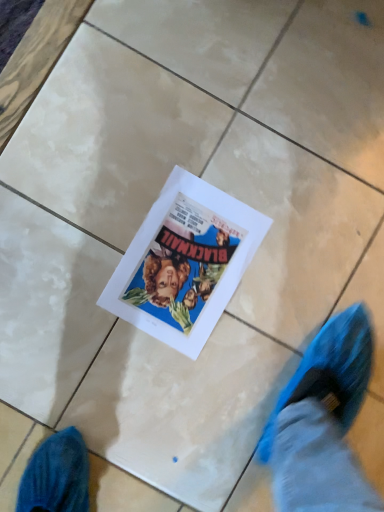
What do you see at coordinates (184, 262) in the screenshot? Image resolution: width=384 pixels, height=512 pixels. I see `white paper at center` at bounding box center [184, 262].

At what (x,y) coordinates should I click in order to perform the action: click on white paper at center. Please return your answer as a coordinate pair (x, y). Looking at the image, I should click on (184, 262).

The width and height of the screenshot is (384, 512). What are the coordinates of `white paper at center` in the screenshot? It's located at (184, 262).